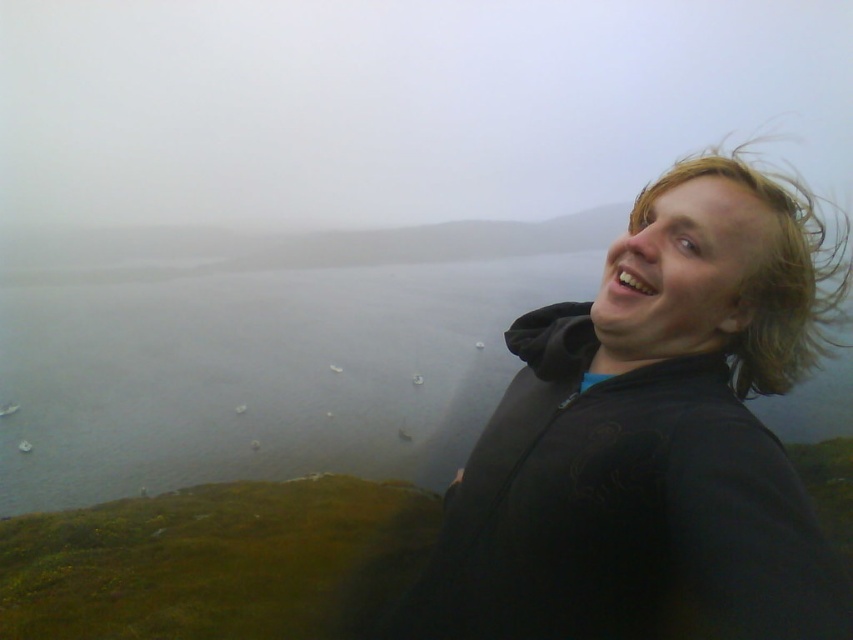
Question: Which point is farther to the camera?

Choices:
 (A) blondehair texture at right
 (B) black matte jacket at upper right

Answer: (A)

Question: Does black matte jacket at upper right appear under blondehair texture at right?

Choices:
 (A) no
 (B) yes

Answer: (B)

Question: From the image, what is the correct spatial relationship of black matte jacket at upper right in relation to blondehair texture at right?

Choices:
 (A) above
 (B) below

Answer: (B)

Question: Is the position of black matte jacket at upper right less distant than that of blondehair texture at right?

Choices:
 (A) yes
 (B) no

Answer: (A)

Question: Which point is closer to the camera?

Choices:
 (A) (573, 596)
 (B) (825, 316)

Answer: (A)

Question: Which point appears farthest from the camera in this image?

Choices:
 (A) (581, 412)
 (B) (834, 288)

Answer: (B)